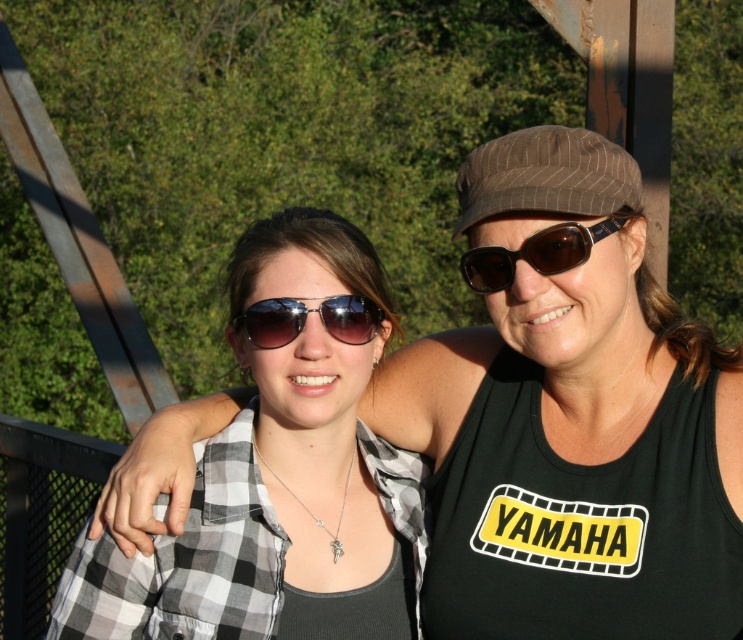
You are a photographer trying to capture a closeup of the metallic reflective sunglasses at center. The black fabric tank top at upper right is blocking your view. Can you estimate whether the tank top is bigger or smaller than the sunglasses?

The black fabric tank top at upper right is larger in size than metallic reflective sunglasses at center, so it is blocking the view because it is bigger.

You are trying to decide which item to pack first for your trip. Since you can only carry one item, which object from the image would you choose between the black checkered shirt at center and the brown reflective sunglasses at upper center, considering their sizes?

The black checkered shirt at center is larger than the brown reflective sunglasses at upper center, so you should choose the black checkered shirt at center to pack first since it takes up more space.